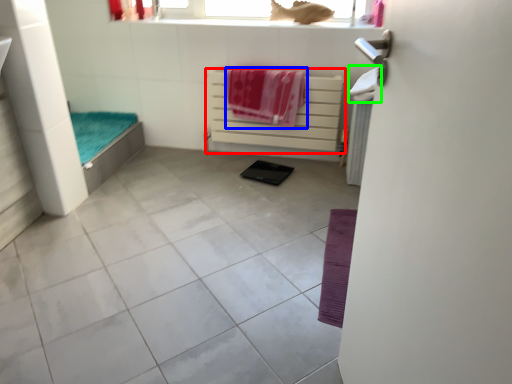
Question: Which object is the closest to the balustrade (highlighted by a red box)? Choose among these: beach towel (highlighted by a blue box) or beach towel (highlighted by a green box).

Choices:
 (A) beach towel
 (B) beach towel

Answer: (A)